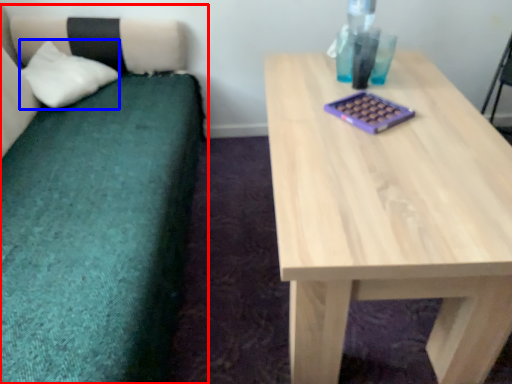
Question: Which point is closer to the camera, studio couch (highlighted by a red box) or pillow (highlighted by a blue box)?

Choices:
 (A) studio couch
 (B) pillow

Answer: (A)